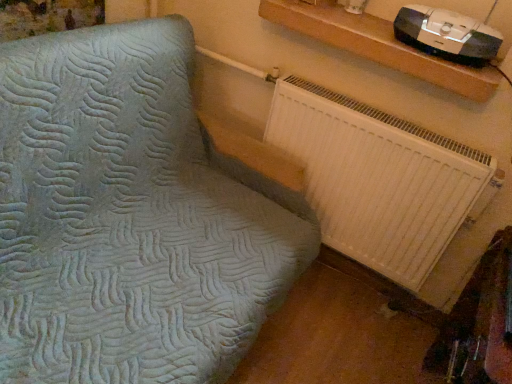
Question: Can we say white plastic radiator at lower right lies outside wooden shelf at upper right?

Choices:
 (A) no
 (B) yes

Answer: (B)

Question: From the image's perspective, would you say white plastic radiator at lower right is shown under wooden shelf at upper right?

Choices:
 (A) yes
 (B) no

Answer: (A)

Question: Is white plastic radiator at lower right thinner than wooden shelf at upper right?

Choices:
 (A) yes
 (B) no

Answer: (A)

Question: Is white plastic radiator at lower right oriented towards wooden shelf at upper right?

Choices:
 (A) no
 (B) yes

Answer: (A)

Question: Is white plastic radiator at lower right at the right side of wooden shelf at upper right?

Choices:
 (A) yes
 (B) no

Answer: (B)

Question: Is white plastic radiator at lower right shorter than wooden shelf at upper right?

Choices:
 (A) no
 (B) yes

Answer: (A)

Question: Does white plastic radiator at lower right turn towards black plastic stereo at upper right?

Choices:
 (A) no
 (B) yes

Answer: (A)

Question: Can you confirm if white plastic radiator at lower right is taller than black plastic stereo at upper right?

Choices:
 (A) yes
 (B) no

Answer: (A)

Question: Is white plastic radiator at lower right with black plastic stereo at upper right?

Choices:
 (A) no
 (B) yes

Answer: (A)

Question: Is the depth of white plastic radiator at lower right greater than that of black plastic stereo at upper right?

Choices:
 (A) no
 (B) yes

Answer: (B)

Question: Are white plastic radiator at lower right and black plastic stereo at upper right located far from each other?

Choices:
 (A) no
 (B) yes

Answer: (A)

Question: From the image's perspective, is white plastic radiator at lower right on top of black plastic stereo at upper right?

Choices:
 (A) no
 (B) yes

Answer: (A)

Question: Is black plastic stereo at upper right smaller than wooden shelf at upper right?

Choices:
 (A) yes
 (B) no

Answer: (A)